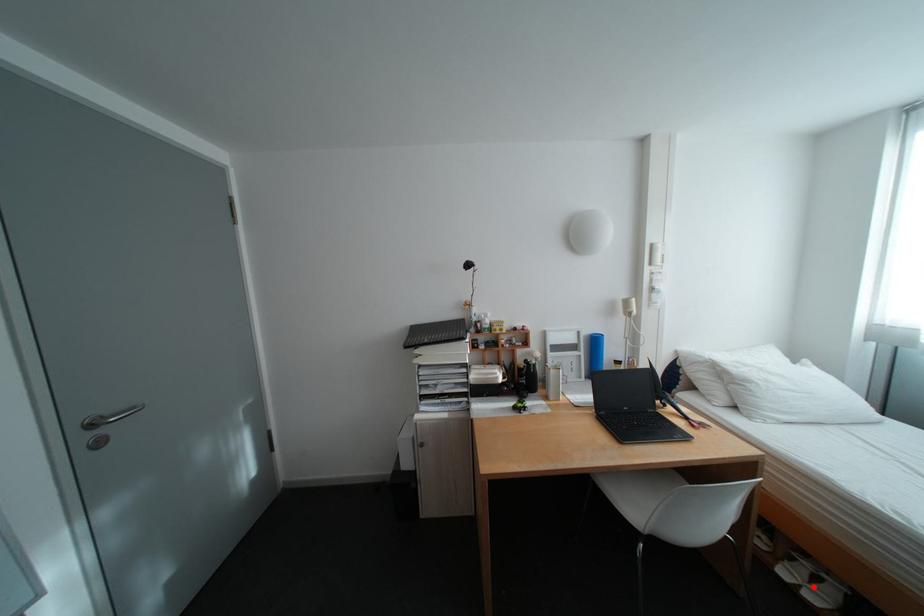
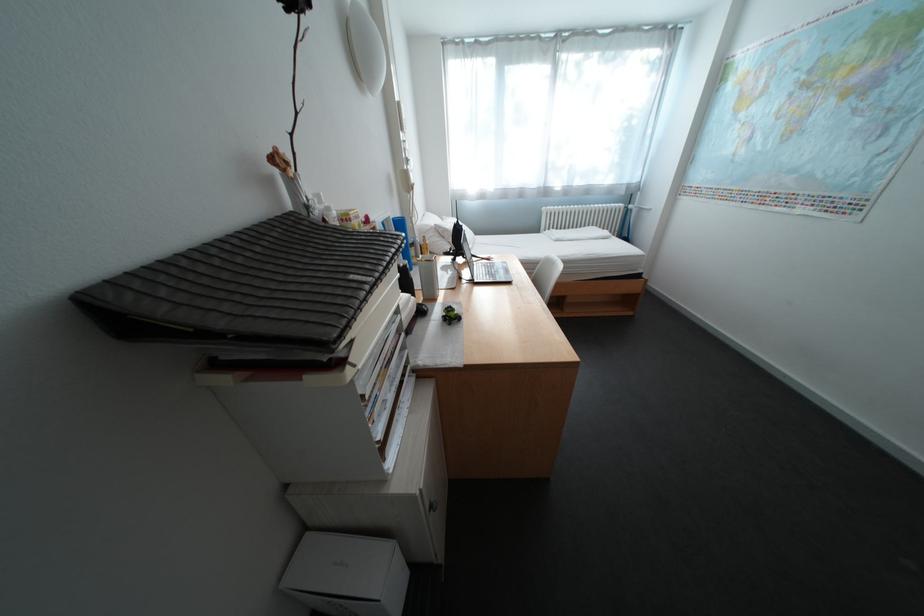
Question: I am providing you with two images of the same scene from different viewpoints. A red point is marked on the first image. Is the red point's position out of view in image 2?

Choices:
 (A) Yes
 (B) No

Answer: (A)